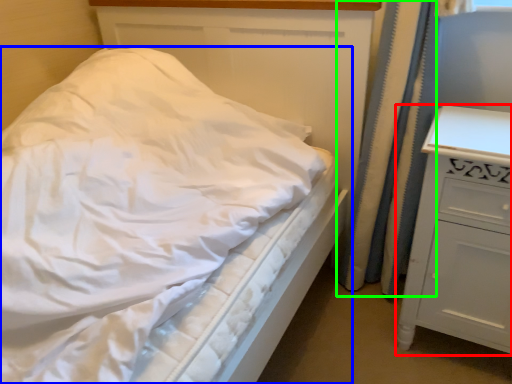
Question: Considering the real-world distances, which object is closest to chest of drawers (highlighted by a red box)? bed (highlighted by a blue box) or curtain (highlighted by a green box).

Choices:
 (A) bed
 (B) curtain

Answer: (B)